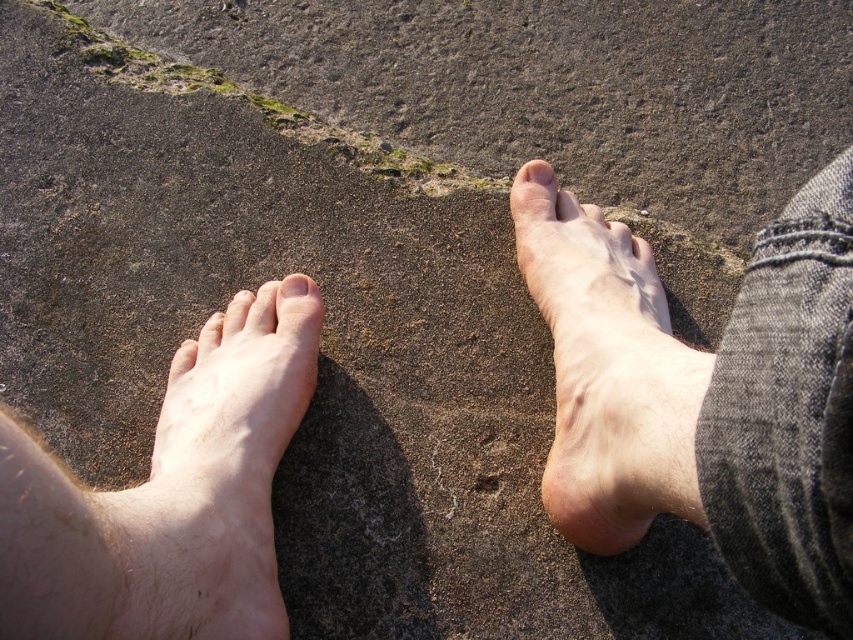
Is point (554, 316) positioned behind point (538, 179)?

No, it is not.

Based on the photo, is pale skin/soft flesh at center smaller than matte skin toe at upper center?

No.

Is point (647, 456) farther from camera compared to point (543, 176)?

No, it is not.

Where is `pale skin/soft flesh at center`? The height and width of the screenshot is (640, 853). pale skin/soft flesh at center is located at coordinates (608, 374).

Between skinny barefoot at right and matte skin toe at upper center, which one has less height?

matte skin toe at upper center is shorter.

What are the coordinates of `skinny barefoot at right` in the screenshot? It's located at (706, 396).

Does skinny barefoot at right appear on the left side of pale skin/soft flesh at center?

Incorrect, skinny barefoot at right is not on the left side of pale skin/soft flesh at center.

Does point (613, 317) come closer to viewer compared to point (543, 492)?

That is True.

Is point (834, 394) positioned behind point (601, 540)?

That is False.

Locate an element on the screen. The height and width of the screenshot is (640, 853). skinny barefoot at right is located at coordinates (706, 396).